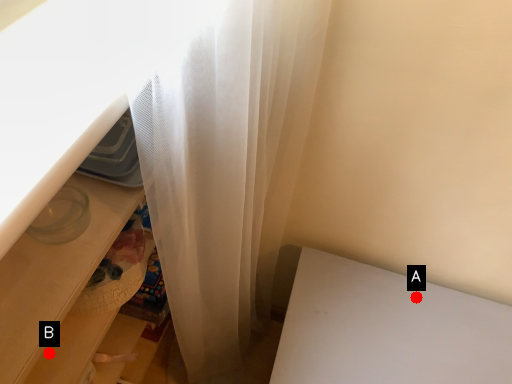
Question: Two points are circled on the image, labeled by A and B beside each circle. Among these points, which one is nearest to the camera?

Choices:
 (A) A is closer
 (B) B is closer

Answer: (B)